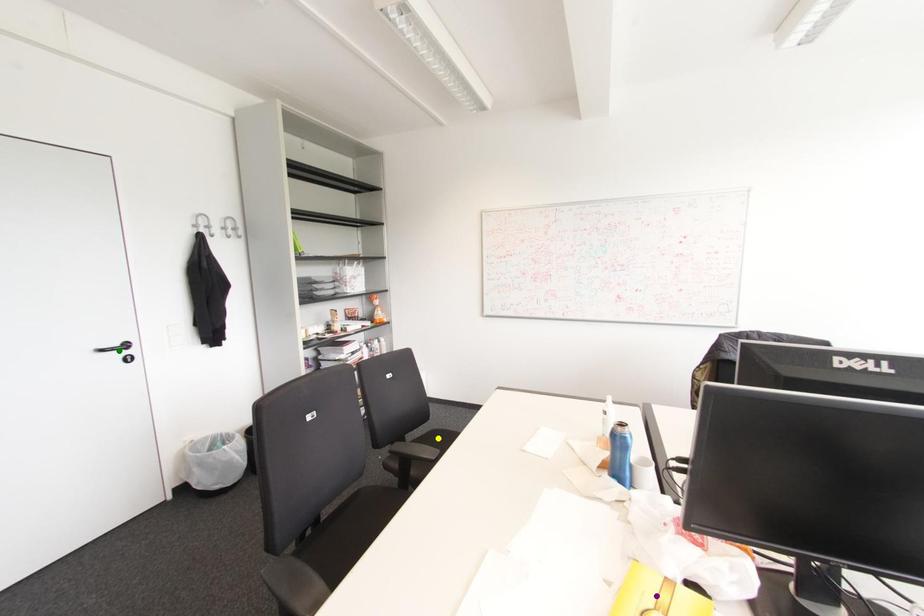
Order these from nearest to farthest:
A) yellow point
B) purple point
C) green point

1. purple point
2. green point
3. yellow point